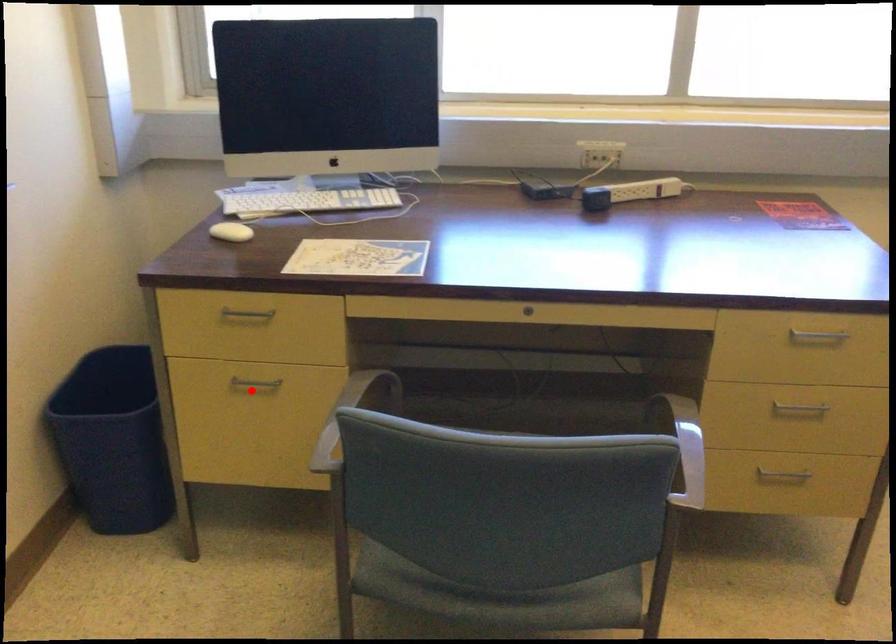
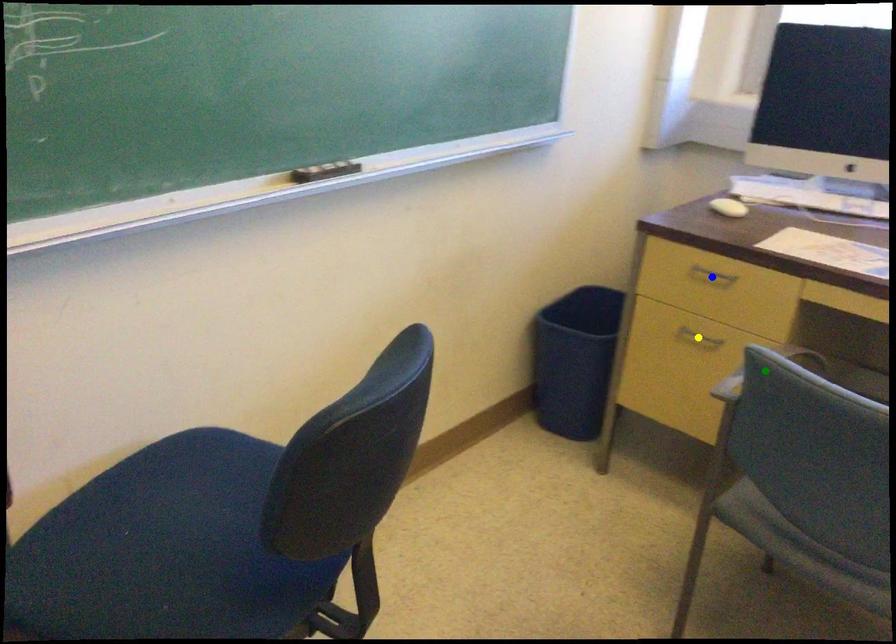
Question: I am providing you with two images of the same scene from different viewpoints. A red point is marked on the first image. You are given multiple points on the second image. Which point in image 2 is actually the same real-world point as the red point in image 1?

Choices:
 (A) blue point
 (B) yellow point
 (C) green point

Answer: (B)